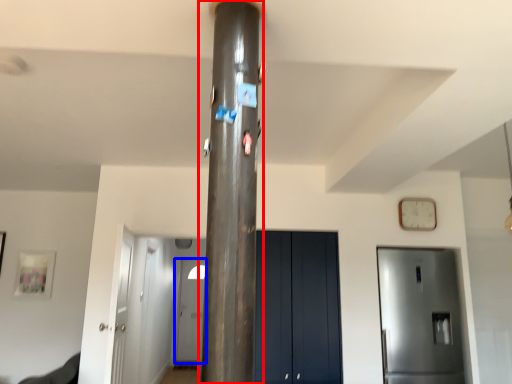
Question: Among these objects, which one is farthest to the camera, pillar (highlighted by a red box) or door (highlighted by a blue box)?

Choices:
 (A) pillar
 (B) door

Answer: (B)